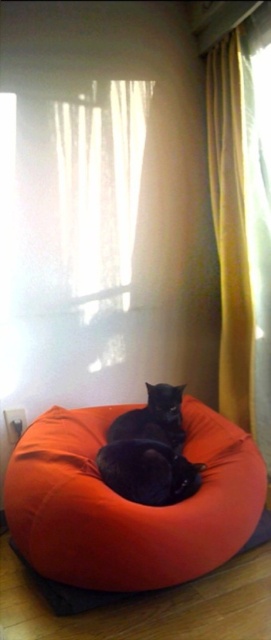
Question: Which object is positioned farthest from the orange fabric cat bed at center?

Choices:
 (A) orange fabric bean bag at center
 (B) yellow fabric curtain at right
 (C) black matte cat at center

Answer: (B)

Question: Does black matte cat at center appear on the right side of black fur cat at center?

Choices:
 (A) no
 (B) yes

Answer: (B)

Question: Which point is closer to the camera?

Choices:
 (A) black fur cat at center
 (B) black matte cat at center
 (C) orange fabric bean bag at center

Answer: (C)

Question: Is black matte cat at center positioned behind orange fabric cat bed at center?

Choices:
 (A) yes
 (B) no

Answer: (A)

Question: Based on their relative distances, which object is farther from the orange fabric cat bed at center?

Choices:
 (A) orange fabric bean bag at center
 (B) black fur cat at center
 (C) yellow fabric curtain at right
 (D) black matte cat at center

Answer: (C)

Question: From the image, what is the correct spatial relationship of orange fabric bean bag at center in relation to black matte cat at center?

Choices:
 (A) left
 (B) right

Answer: (A)